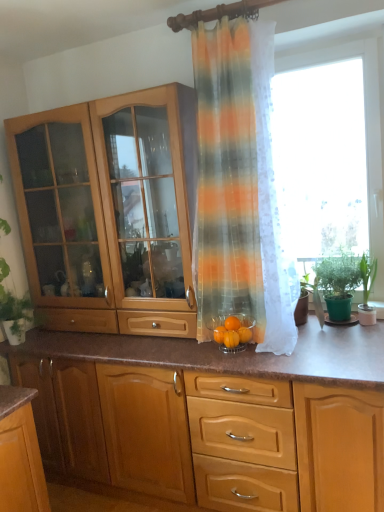
Locate an element on the screen. The width and height of the screenshot is (384, 512). blank space to the left of orange matte glass bowl at center, the first orange from the right is located at coordinates (210, 348).